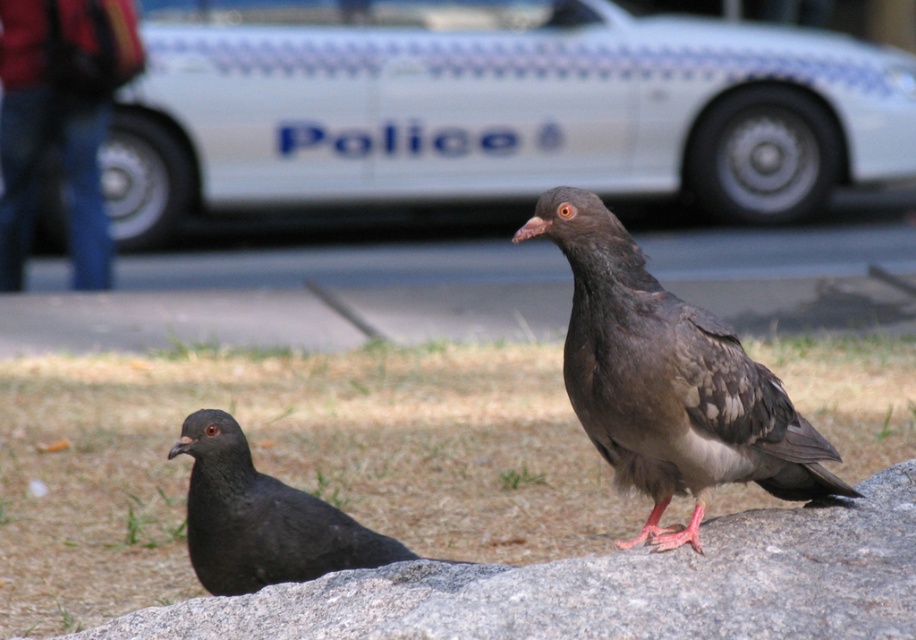
Question: Can you confirm if gray granite rock at center is positioned above dark gray feathered pigeon at center?

Choices:
 (A) no
 (B) yes

Answer: (A)

Question: Does gray granite rock at center have a lesser width compared to dark gray feathered pigeon at center?

Choices:
 (A) yes
 (B) no

Answer: (B)

Question: Which point is farther to the camera?

Choices:
 (A) dark gray feathered pigeon at center
 (B) red backpack at upper left
 (C) gray granite rock at center
 (D) matte black pigeon at lower left

Answer: (B)

Question: Can you confirm if gray granite rock at center is bigger than red backpack at upper left?

Choices:
 (A) yes
 (B) no

Answer: (B)

Question: Which point appears closest to the camera in this image?

Choices:
 (A) (707, 337)
 (B) (83, 268)
 (C) (354, 637)
 (D) (289, 506)

Answer: (C)

Question: Estimate the real-world distances between objects in this image. Which object is closer to the gray granite rock at center?

Choices:
 (A) red backpack at upper left
 (B) dark gray feathered pigeon at center
 (C) matte black pigeon at lower left

Answer: (B)